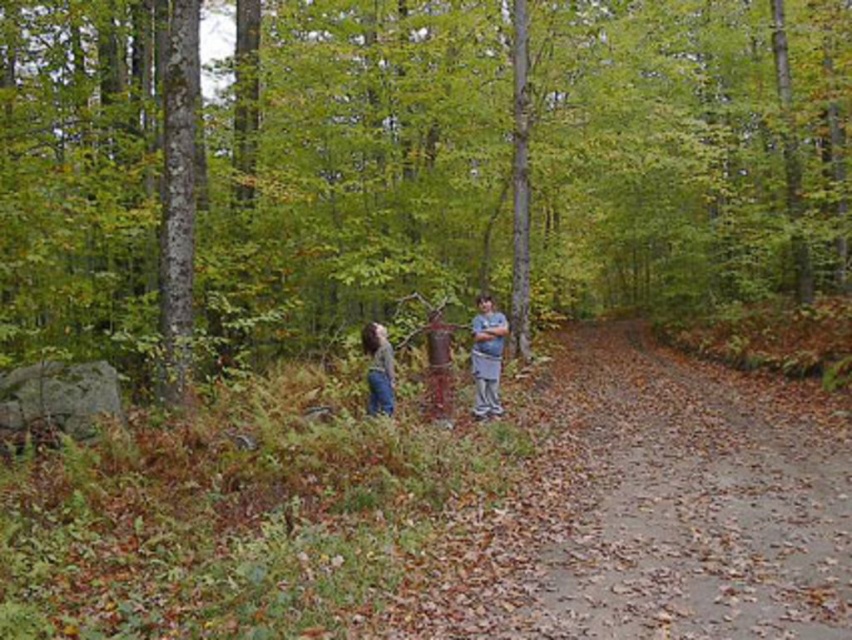
Can you confirm if green matte tree at center is positioned below gray cotton shirt at center?

No, green matte tree at center is not below gray cotton shirt at center.

Can you confirm if green matte tree at center is taller than gray cotton shirt at center?

Yes.

Who is more forward, (726, 115) or (488, 368)?

Point (488, 368)

Identify the location of green matte tree at center. The height and width of the screenshot is (640, 852). (422, 173).

Can you confirm if gray cotton shirt at center is thinner than denim jeans at center?

No.

Does gray cotton shirt at center appear on the left side of denim jeans at center?

In fact, gray cotton shirt at center is to the right of denim jeans at center.

Which is in front, point (475, 376) or point (384, 381)?

Positioned in front is point (384, 381).

This screenshot has width=852, height=640. I want to click on gray cotton shirt at center, so click(x=486, y=356).

Is green matte tree at center wider than denim jeans at center?

Yes, green matte tree at center is wider than denim jeans at center.

Is the position of green matte tree at center less distant than that of denim jeans at center?

No, it is behind denim jeans at center.

You are a GUI agent. You are given a task and a screenshot of the screen. Output one action in this format:
    pyautogui.click(x=<x>, y=<y>)
    Task: Click on the green matte tree at center
    This screenshot has width=852, height=640.
    Given the screenshot: What is the action you would take?
    pyautogui.click(x=422, y=173)